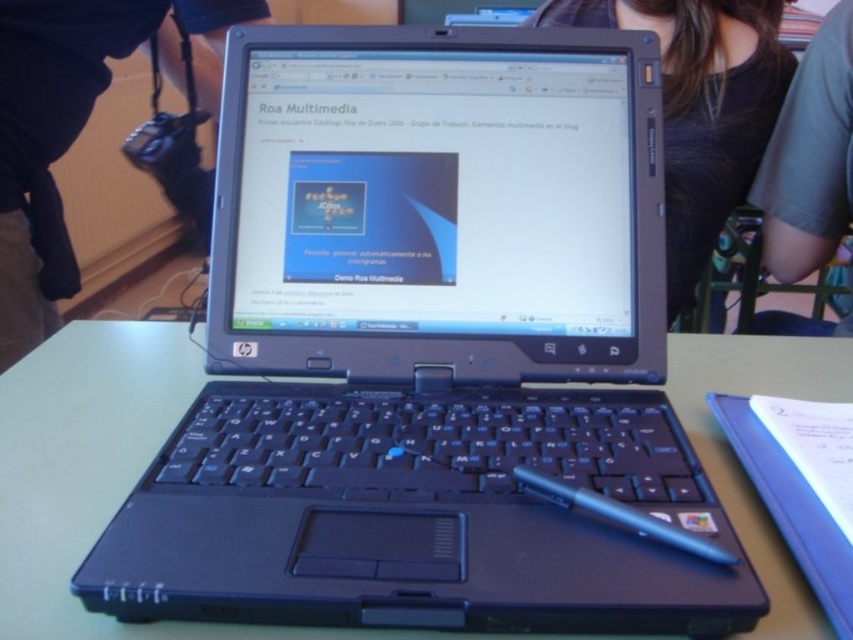
Is green matte table at center closer to camera compared to black plastic laptop at center?

Yes, green matte table at center is closer to the viewer.

Between point (113, 346) and point (28, 188), which one is positioned in front?

Point (113, 346) is in front.

At what (x,y) coordinates should I click in order to perform the action: click on green matte table at center. Please return your answer as a coordinate pair (x, y). The width and height of the screenshot is (853, 640). Looking at the image, I should click on (84, 465).

Which is in front, point (766, 572) or point (685, 532)?

Point (685, 532) is more forward.

Is green matte table at center to the right of blue plastic pen at center from the viewer's perspective?

Incorrect, green matte table at center is not on the right side of blue plastic pen at center.

You are a GUI agent. You are given a task and a screenshot of the screen. Output one action in this format:
    pyautogui.click(x=<x>, y=<y>)
    Task: Click on the green matte table at center
    The width and height of the screenshot is (853, 640).
    Given the screenshot: What is the action you would take?
    pyautogui.click(x=84, y=465)

Between black plastic laptop at center and blue plastic pen at center, which one appears on the left side from the viewer's perspective?

black plastic laptop at center

Is point (178, 60) in front of point (714, 541)?

No, (178, 60) is behind (714, 541).

The width and height of the screenshot is (853, 640). Find the location of `black plastic laptop at center`. black plastic laptop at center is located at coordinates (73, 125).